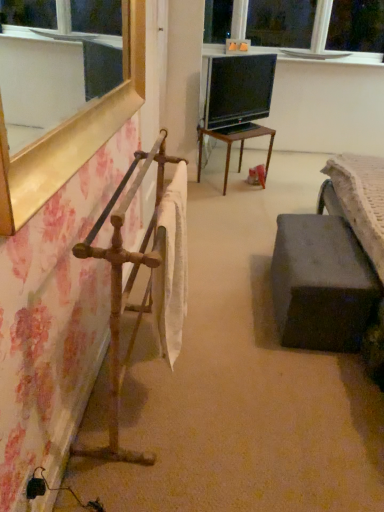
Locate an element on the screen. This screenshot has width=384, height=512. free spot in front of wooden table at center is located at coordinates (236, 202).